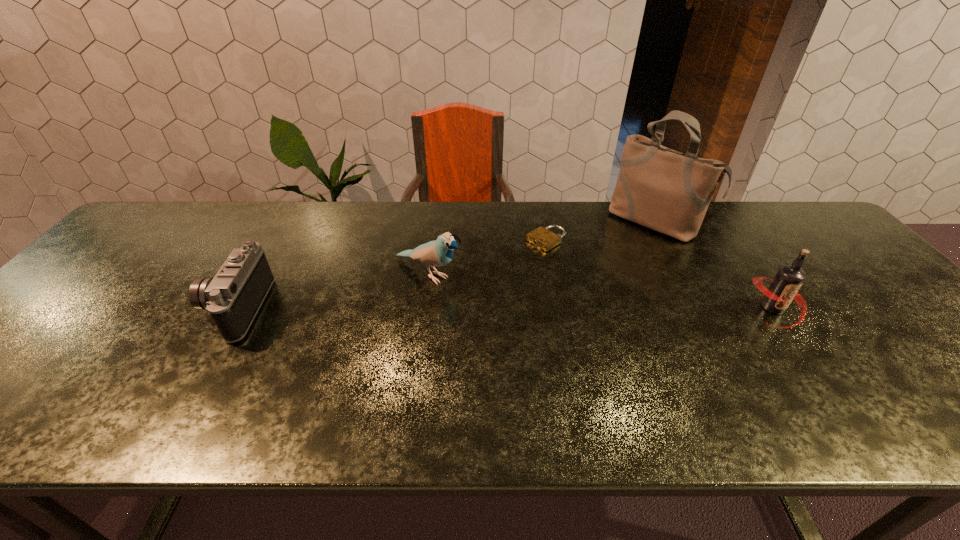
This screenshot has height=540, width=960. I want to click on the second shortest object, so click(x=233, y=297).

This screenshot has height=540, width=960. I want to click on the leftmost object, so click(x=233, y=297).

Identify the location of root beer. tap(784, 288).

The image size is (960, 540). I want to click on bird, so click(437, 253).

Locate an element on the screen. This screenshot has width=960, height=540. padlock is located at coordinates (x=544, y=239).

This screenshot has width=960, height=540. I want to click on the shortest object, so click(544, 239).

The height and width of the screenshot is (540, 960). What are the coordinates of `shoulder bag` in the screenshot? It's located at (667, 191).

In order to click on free space located on the front-facing side of the camera in this screenshot , I will do `click(60, 308)`.

Locate an element on the screen. vacant region located on the front-facing side of the camera is located at coordinates (57, 308).

I want to click on free space located on the front-facing side of the camera, so click(x=81, y=308).